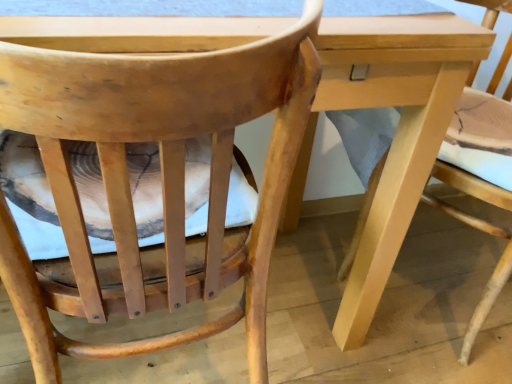
What do you see at coordinates (162, 177) in the screenshot?
I see `wooden chair at center, which ranks as the 2th chair in right-to-left order` at bounding box center [162, 177].

The image size is (512, 384). Identify the location of wooden chair at center, which ranks as the 2th chair in right-to-left order. (162, 177).

Measure the distance between wooden chair at center, which is counted as the first chair, starting from the left, and camera.

wooden chair at center, which is counted as the first chair, starting from the left, and camera are 28.64 centimeters apart.

Describe the element at coordinates (484, 114) in the screenshot. The image size is (512, 384). I see `natural wood chair at center, positioned as the 2th chair in left-to-right order` at that location.

Find the location of a particular element. The width and height of the screenshot is (512, 384). natural wood chair at center, placed as the 1th chair when sorted from right to left is located at coordinates (484, 114).

You are a GUI agent. You are given a task and a screenshot of the screen. Output one action in this format:
    pyautogui.click(x=<x>, y=<y>)
    Task: Click on the wooden chair at center, which is counted as the first chair, starting from the left
    The image size is (512, 384).
    Given the screenshot: What is the action you would take?
    pyautogui.click(x=162, y=177)

Between wooden chair at center, which is counted as the first chair, starting from the left, and natural wood chair at center, positioned as the 2th chair in left-to-right order, which one appears on the right side from the viewer's perspective?

natural wood chair at center, positioned as the 2th chair in left-to-right order, is more to the right.

Which is behind, wooden chair at center, which is counted as the first chair, starting from the left, or natural wood chair at center, positioned as the 2th chair in left-to-right order?

natural wood chair at center, positioned as the 2th chair in left-to-right order, is behind.

Does point (287, 35) come farther from viewer compared to point (475, 74)?

No, (287, 35) is closer to viewer.

From the image's perspective, is wooden chair at center, which ranks as the 2th chair in right-to-left order, located above or below natural wood chair at center, positioned as the 2th chair in left-to-right order?

From the image's perspective, wooden chair at center, which ranks as the 2th chair in right-to-left order, appears below natural wood chair at center, positioned as the 2th chair in left-to-right order.

From a real-world perspective, is wooden chair at center, which ranks as the 2th chair in right-to-left order, physically located above or below natural wood chair at center, placed as the 1th chair when sorted from right to left?

wooden chair at center, which ranks as the 2th chair in right-to-left order, is situated higher than natural wood chair at center, placed as the 1th chair when sorted from right to left, in the real world.

Between wooden chair at center, which ranks as the 2th chair in right-to-left order, and natural wood chair at center, placed as the 1th chair when sorted from right to left, which one has larger width?

Wider between the two is natural wood chair at center, placed as the 1th chair when sorted from right to left.

In terms of height, does wooden chair at center, which is counted as the first chair, starting from the left, look taller or shorter compared to natural wood chair at center, placed as the 1th chair when sorted from right to left?

Considering their sizes, wooden chair at center, which is counted as the first chair, starting from the left, has more height than natural wood chair at center, placed as the 1th chair when sorted from right to left.

Looking at the image, does wooden chair at center, which ranks as the 2th chair in right-to-left order, seem bigger or smaller compared to natural wood chair at center, placed as the 1th chair when sorted from right to left?

Clearly, wooden chair at center, which ranks as the 2th chair in right-to-left order, is smaller in size than natural wood chair at center, placed as the 1th chair when sorted from right to left.

Is wooden chair at center, which ranks as the 2th chair in right-to-left order, spatially inside natural wood chair at center, positioned as the 2th chair in left-to-right order, or outside of it?

wooden chair at center, which ranks as the 2th chair in right-to-left order, cannot be found inside natural wood chair at center, positioned as the 2th chair in left-to-right order.

Would you consider wooden chair at center, which is counted as the first chair, starting from the left, to be distant from natural wood chair at center, placed as the 1th chair when sorted from right to left?

That's not correct — wooden chair at center, which is counted as the first chair, starting from the left, is a little close to natural wood chair at center, placed as the 1th chair when sorted from right to left.

Is wooden chair at center, which ranks as the 2th chair in right-to-left order, oriented away from natural wood chair at center, positioned as the 2th chair in left-to-right order?

No.

Can you tell me how much wooden chair at center, which is counted as the first chair, starting from the left, and natural wood chair at center, placed as the 1th chair when sorted from right to left, differ in facing direction?

The angle between the facing direction of wooden chair at center, which is counted as the first chair, starting from the left, and the facing direction of natural wood chair at center, placed as the 1th chair when sorted from right to left, is 122 degrees.

Locate an element on the screen. chair positioned vertically above the natural wood chair at center, placed as the 1th chair when sorted from right to left (from a real-world perspective) is located at coordinates (162, 177).

Between natural wood chair at center, placed as the 1th chair when sorted from right to left, and wooden chair at center, which ranks as the 2th chair in right-to-left order, which one appears on the right side from the viewer's perspective?

natural wood chair at center, placed as the 1th chair when sorted from right to left.

From the picture: Considering the positions of objects natural wood chair at center, placed as the 1th chair when sorted from right to left, and wooden chair at center, which ranks as the 2th chair in right-to-left order, in the image provided, who is in front, natural wood chair at center, placed as the 1th chair when sorted from right to left, or wooden chair at center, which ranks as the 2th chair in right-to-left order,?

Positioned in front is wooden chair at center, which ranks as the 2th chair in right-to-left order.

Consider the image. Which is closer to the camera, [462,115] or [44,357]?

Clearly, point [462,115] is more distant from the camera than point [44,357].

Based on the photo, from the image's perspective, would you say natural wood chair at center, positioned as the 2th chair in left-to-right order, is shown under wooden chair at center, which ranks as the 2th chair in right-to-left order?

Incorrect, from the image's perspective, natural wood chair at center, positioned as the 2th chair in left-to-right order, is higher than wooden chair at center, which ranks as the 2th chair in right-to-left order.

From a real-world perspective, does natural wood chair at center, positioned as the 2th chair in left-to-right order, sit lower than wooden chair at center, which ranks as the 2th chair in right-to-left order?

Yes, from a real-world perspective, natural wood chair at center, positioned as the 2th chair in left-to-right order, is beneath wooden chair at center, which ranks as the 2th chair in right-to-left order.

Considering the relative sizes of natural wood chair at center, positioned as the 2th chair in left-to-right order, and wooden chair at center, which ranks as the 2th chair in right-to-left order, in the image provided, is natural wood chair at center, positioned as the 2th chair in left-to-right order, wider than wooden chair at center, which ranks as the 2th chair in right-to-left order,?

Correct, the width of natural wood chair at center, positioned as the 2th chair in left-to-right order, exceeds that of wooden chair at center, which ranks as the 2th chair in right-to-left order.

Who is shorter, natural wood chair at center, placed as the 1th chair when sorted from right to left, or wooden chair at center, which ranks as the 2th chair in right-to-left order?

natural wood chair at center, placed as the 1th chair when sorted from right to left.

Is natural wood chair at center, placed as the 1th chair when sorted from right to left, bigger or smaller than wooden chair at center, which is counted as the first chair, starting from the left?

natural wood chair at center, placed as the 1th chair when sorted from right to left, is bigger than wooden chair at center, which is counted as the first chair, starting from the left.

Is natural wood chair at center, positioned as the 2th chair in left-to-right order, completely or partially outside of wooden chair at center, which ranks as the 2th chair in right-to-left order?

Yes, natural wood chair at center, positioned as the 2th chair in left-to-right order, is located beyond the bounds of wooden chair at center, which ranks as the 2th chair in right-to-left order.

Is natural wood chair at center, positioned as the 2th chair in left-to-right order, far away from wooden chair at center, which is counted as the first chair, starting from the left?

No, there isn't a large distance between natural wood chair at center, positioned as the 2th chair in left-to-right order, and wooden chair at center, which is counted as the first chair, starting from the left.

Is natural wood chair at center, positioned as the 2th chair in left-to-right order, aimed at wooden chair at center, which ranks as the 2th chair in right-to-left order?

Yes, natural wood chair at center, positioned as the 2th chair in left-to-right order, is aimed at wooden chair at center, which ranks as the 2th chair in right-to-left order.

What's the angular difference between natural wood chair at center, positioned as the 2th chair in left-to-right order, and wooden chair at center, which is counted as the first chair, starting from the left,'s facing directions?

The angle between the facing direction of natural wood chair at center, positioned as the 2th chair in left-to-right order, and the facing direction of wooden chair at center, which is counted as the first chair, starting from the left, is 122 degrees.

In the scene shown: Measure the distance between natural wood chair at center, placed as the 1th chair when sorted from right to left, and wooden chair at center, which is counted as the first chair, starting from the left.

They are 19.83 inches apart.

Identify the location of chair positioned vertically above the natural wood chair at center, placed as the 1th chair when sorted from right to left (from a real-world perspective). The width and height of the screenshot is (512, 384). (162, 177).

The width and height of the screenshot is (512, 384). Find the location of `chair above the natural wood chair at center, placed as the 1th chair when sorted from right to left (from a real-world perspective)`. chair above the natural wood chair at center, placed as the 1th chair when sorted from right to left (from a real-world perspective) is located at coordinates (162, 177).

Identify the location of chair in front of the natural wood chair at center, placed as the 1th chair when sorted from right to left. The height and width of the screenshot is (384, 512). (162, 177).